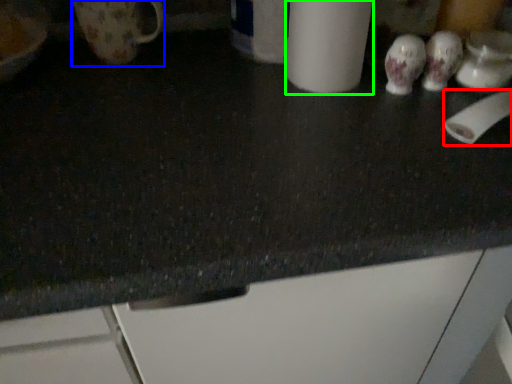
Question: Which is nearer to the toilet paper (highlighted by a red box)? mug (highlighted by a blue box) or paper towel (highlighted by a green box).

Choices:
 (A) mug
 (B) paper towel

Answer: (B)